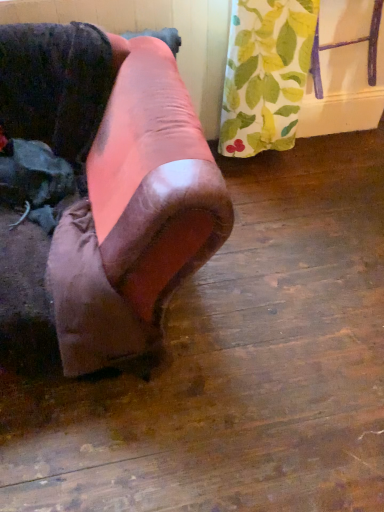
Question: From a real-world perspective, is leather couch at left, marked as the 2th furniture in a top-to-bottom arrangement, located beneath green leaf-patterned curtain at upper right, the second furniture ordered from the bottom?

Choices:
 (A) yes
 (B) no

Answer: (A)

Question: Is leather couch at left, marked as the 2th furniture in a top-to-bottom arrangement, oriented away from green leaf-patterned curtain at upper right, which appears as the 1th furniture when viewed from the top?

Choices:
 (A) yes
 (B) no

Answer: (B)

Question: Does leather couch at left, acting as the second furniture starting from the right, turn towards green leaf-patterned curtain at upper right, the second furniture ordered from the bottom?

Choices:
 (A) no
 (B) yes

Answer: (A)

Question: Is leather couch at left, which is the 1th furniture in left-to-right order, closer to camera compared to green leaf-patterned curtain at upper right, acting as the 1th furniture starting from the right?

Choices:
 (A) yes
 (B) no

Answer: (A)

Question: Would you say leather couch at left, which is the 1th furniture in left-to-right order, is a long distance from green leaf-patterned curtain at upper right, acting as the 1th furniture starting from the right?

Choices:
 (A) yes
 (B) no

Answer: (A)

Question: Is leather couch at left, acting as the second furniture starting from the right, further to camera compared to green leaf-patterned curtain at upper right, the second furniture ordered from the bottom?

Choices:
 (A) yes
 (B) no

Answer: (B)

Question: Is green leaf-patterned curtain at upper right, acting as the 1th furniture starting from the right, closer to camera compared to leather couch at left, acting as the second furniture starting from the right?

Choices:
 (A) yes
 (B) no

Answer: (B)

Question: Is green leaf-patterned curtain at upper right, which is the 2th furniture in left-to-right order, looking in the opposite direction of leather couch at left, marked as the 2th furniture in a top-to-bottom arrangement?

Choices:
 (A) yes
 (B) no

Answer: (B)

Question: Considering the relative sizes of green leaf-patterned curtain at upper right, the second furniture ordered from the bottom, and leather couch at left, which is the 1th furniture in left-to-right order, in the image provided, is green leaf-patterned curtain at upper right, the second furniture ordered from the bottom, bigger than leather couch at left, which is the 1th furniture in left-to-right order,?

Choices:
 (A) no
 (B) yes

Answer: (A)

Question: From the image's perspective, is green leaf-patterned curtain at upper right, the second furniture ordered from the bottom, above leather couch at left, which is the 1th furniture in left-to-right order?

Choices:
 (A) yes
 (B) no

Answer: (A)

Question: Is green leaf-patterned curtain at upper right, acting as the 1th furniture starting from the right, further to the viewer compared to leather couch at left, which appears as the first furniture when ordered from the bottom?

Choices:
 (A) no
 (B) yes

Answer: (B)

Question: Could you tell me if green leaf-patterned curtain at upper right, acting as the 1th furniture starting from the right, is facing leather couch at left, which appears as the first furniture when ordered from the bottom?

Choices:
 (A) no
 (B) yes

Answer: (A)

Question: Looking at their shapes, would you say leather couch at left, marked as the 2th furniture in a top-to-bottom arrangement, is wider or thinner than green leaf-patterned curtain at upper right, which is the 2th furniture in left-to-right order?

Choices:
 (A) wide
 (B) thin

Answer: (A)